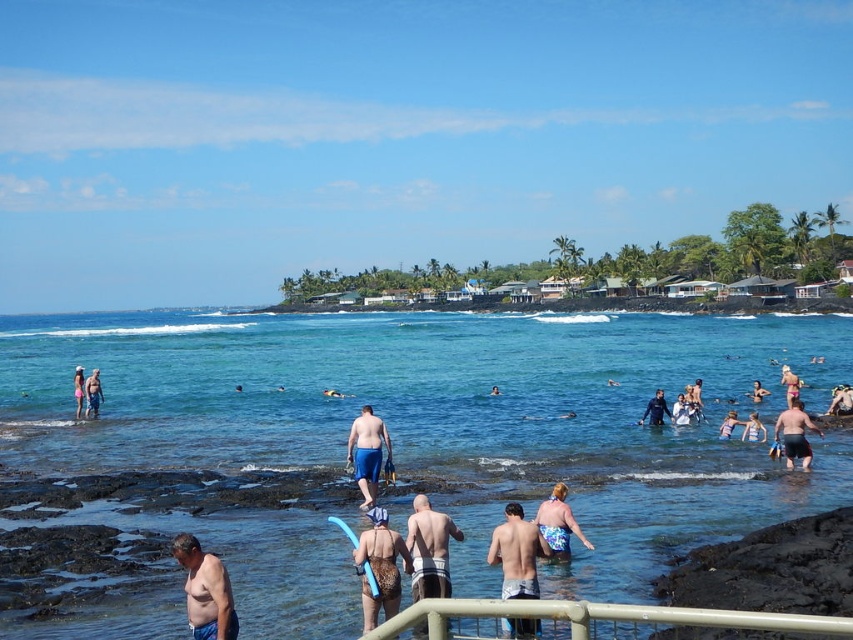
Is smooth skin man at center to the right of smooth skin person at center from the viewer's perspective?

Incorrect, smooth skin man at center is not on the right side of smooth skin person at center.

From the picture: Does smooth skin man at center have a lesser width compared to smooth skin person at center?

Indeed, smooth skin man at center has a lesser width compared to smooth skin person at center.

Measure the distance between smooth skin man at center and camera.

A distance of 23.43 meters exists between smooth skin man at center and camera.

Where is `smooth skin man at center`? The image size is (853, 640). smooth skin man at center is located at coordinates (428, 548).

Consider the image. Is skinny man at lower left thinner than black matte shorts at lower right?

Indeed, skinny man at lower left has a lesser width compared to black matte shorts at lower right.

At what (x,y) coordinates should I click in order to perform the action: click on skinny man at lower left. Please return your answer as a coordinate pair (x, y). Looking at the image, I should click on (206, 589).

The image size is (853, 640). In order to click on smooth skin man at center in this screenshot , I will do `click(428, 548)`.

Does point (413, 509) lie behind point (796, 417)?

No, (413, 509) is closer to viewer.

The width and height of the screenshot is (853, 640). Find the location of `smooth skin man at center`. smooth skin man at center is located at coordinates (428, 548).